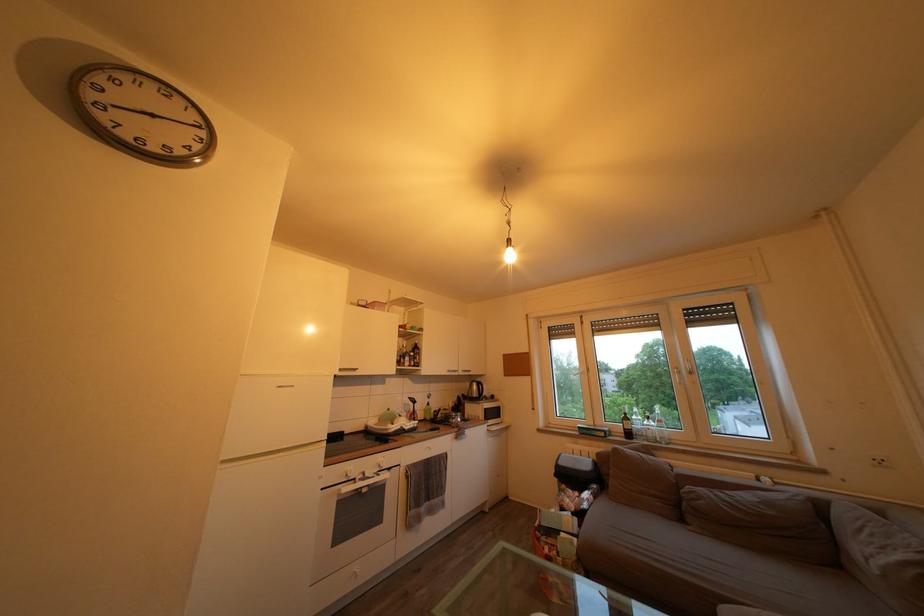
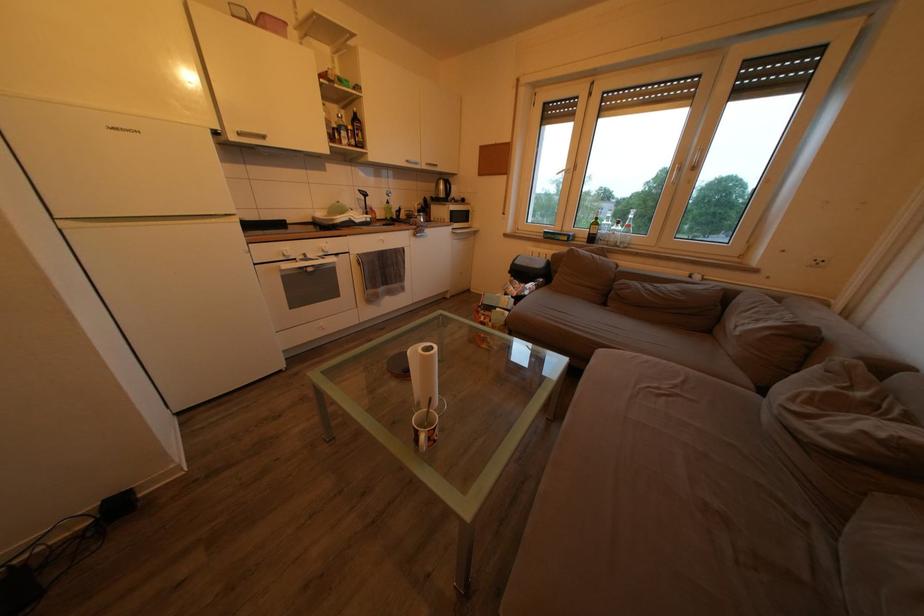
Question: The first image is from the beginning of the video and the second image is from the end. How did the camera likely rotate when shooting the video?

Choices:
 (A) Left
 (B) Right
 (C) Up
 (D) Down

Answer: (D)